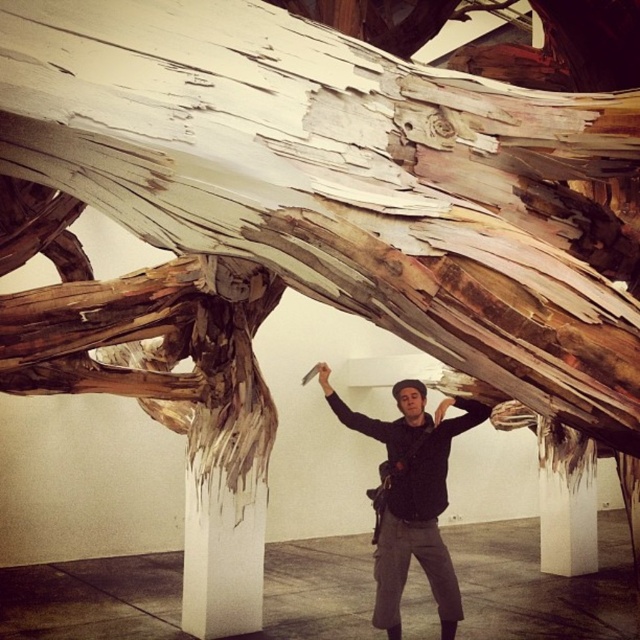
Is matte black jacket at center to the left of white smooth pillar at lower center from the viewer's perspective?

Answer: Yes, matte black jacket at center is to the left of white smooth pillar at lower center.

Can you confirm if matte black jacket at center is wider than white smooth pillar at lower center?

Yes, matte black jacket at center is wider than white smooth pillar at lower center.

I want to click on matte black jacket at center, so click(x=410, y=497).